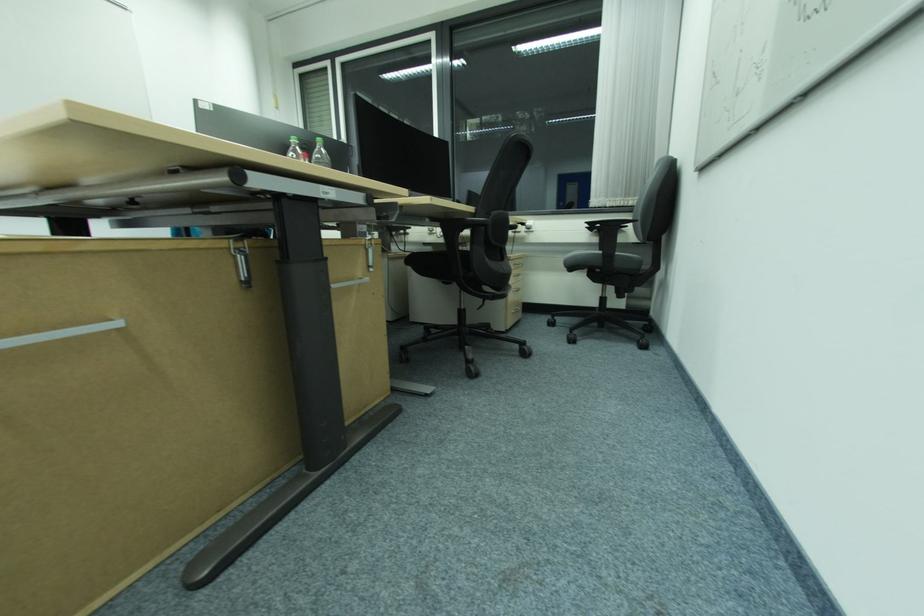
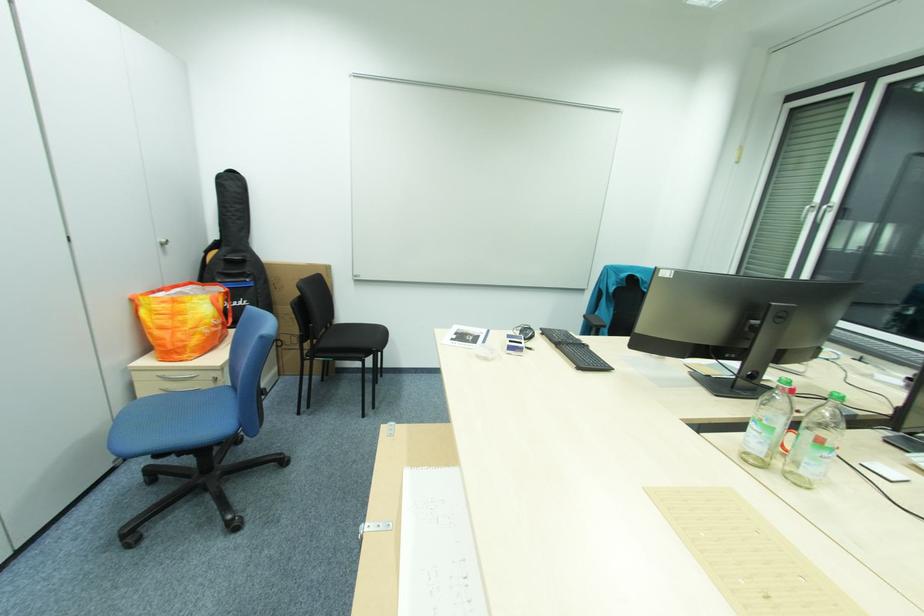
Question: Based on the continuous images, in which direction is the camera rotating? Reply with the corresponding letter.

Choices:
 (A) Left
 (B) Right
 (C) Up
 (D) Down

Answer: (A)